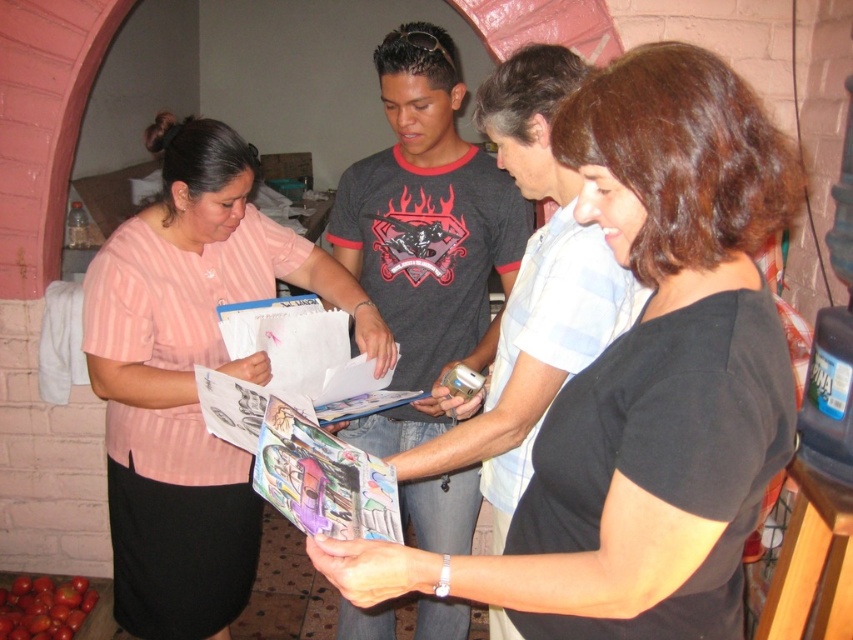
Question: Does black matte shirt at center have a greater width compared to dark gray t-shirt at center?

Choices:
 (A) yes
 (B) no

Answer: (A)

Question: Can you confirm if black matte shirt at center is bigger than shiny red tomatoes at lower left?

Choices:
 (A) yes
 (B) no

Answer: (A)

Question: Which point is farther to the camera?

Choices:
 (A) (163, 278)
 (B) (26, 634)
 (C) (347, 180)
 (D) (625, 90)

Answer: (B)

Question: Which of the following is the closest to the observer?

Choices:
 (A) (94, 602)
 (B) (721, 605)

Answer: (B)

Question: Can you confirm if black matte shirt at center is positioned below pink striped shirt at left?

Choices:
 (A) yes
 (B) no

Answer: (B)

Question: Which object is closer to the camera taking this photo?

Choices:
 (A) pink striped shirt at left
 (B) black matte shirt at center
 (C) dark gray t-shirt at center
 (D) shiny red tomatoes at lower left

Answer: (B)